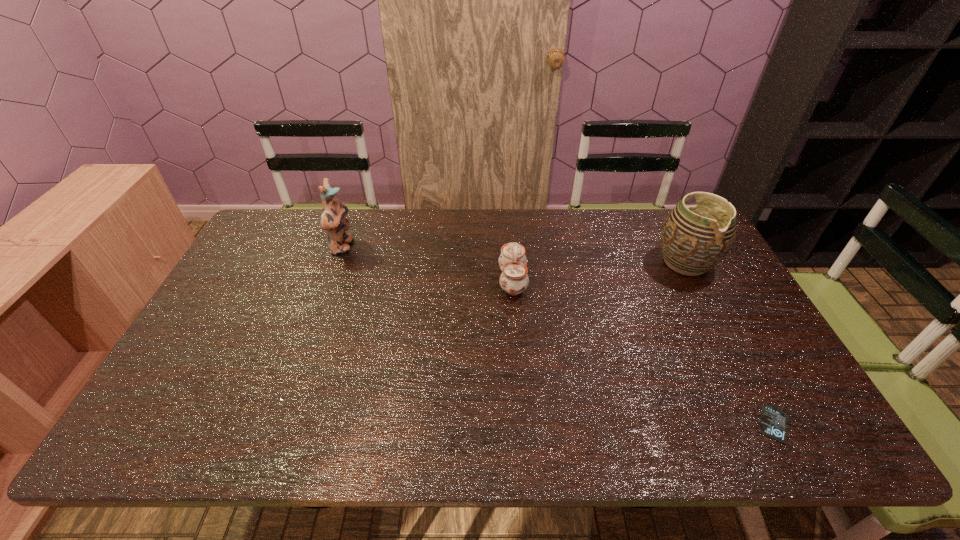
Find the location of a particular element. vacant space that is in between the chinaware and the pottery is located at coordinates (599, 272).

Find the location of a particular element. object that is the second nearest to the chinaware is located at coordinates (333, 220).

This screenshot has height=540, width=960. Find the location of `object that is the closest to the pottery`. object that is the closest to the pottery is located at coordinates (773, 423).

You are a GUI agent. You are given a task and a screenshot of the screen. Output one action in this format:
    pyautogui.click(x=<x>, y=<y>)
    Task: Click on the free space that satisfies the following two spatial constraints: 1. on the front-facing side of the identity card; 2. on the left side of the leftmost object
    The image size is (960, 540).
    Given the screenshot: What is the action you would take?
    pyautogui.click(x=278, y=424)

Identify the location of blank area in the image that satisfies the following two spatial constraints: 1. on the front-facing side of the pottery; 2. on the right side of the leftmost object. This screenshot has height=540, width=960. (337, 263).

Find the location of a particular element. This screenshot has width=960, height=540. free space that satisfies the following two spatial constraints: 1. on the front-facing side of the figurine; 2. on the right side of the pottery is located at coordinates (337, 263).

The height and width of the screenshot is (540, 960). I want to click on vacant space that satisfies the following two spatial constraints: 1. by the handle of the identity card; 2. on the right side of the third object from right to left, so click(524, 424).

Where is `free space that satisfies the following two spatial constraints: 1. by the handle of the chinaware; 2. on the left side of the shortest object`? Image resolution: width=960 pixels, height=540 pixels. free space that satisfies the following two spatial constraints: 1. by the handle of the chinaware; 2. on the left side of the shortest object is located at coordinates pyautogui.click(x=524, y=424).

Find the location of a particular element. This screenshot has height=540, width=960. vacant position in the image that satisfies the following two spatial constraints: 1. by the handle of the nearest object; 2. on the right side of the chinaware is located at coordinates (524, 424).

This screenshot has width=960, height=540. I want to click on free point that satisfies the following two spatial constraints: 1. on the front-facing side of the shortest object; 2. on the right side of the figurine, so click(x=278, y=424).